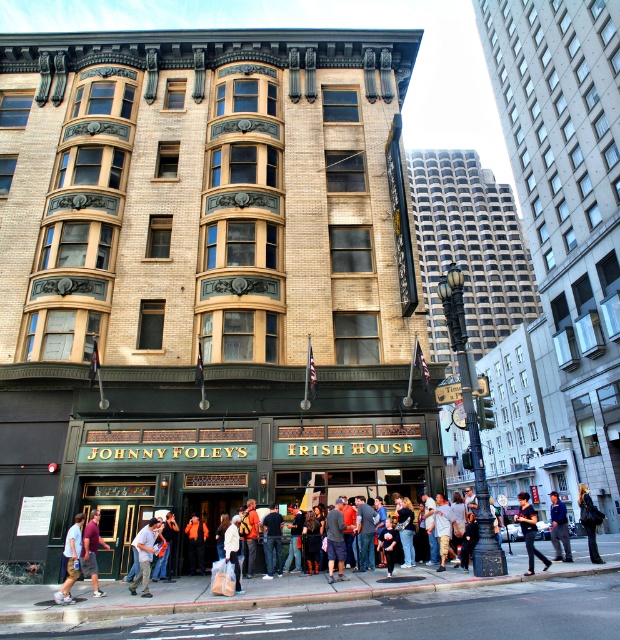
You are a delivery person standing at the entrance of Johnny Foley Irish House. You need to place a black leather jacket at the exact center of the building facade. Is the current position of the black leather jacket at center correct?

The black leather jacket at center is positioned at point (590, 520), which is not the exact center of the building facade. The exact center would be at point (310, 320), so the jacket needs to be moved closer to that coordinate.

You are a photographer standing outside Johnny Foley s Irish House and want to take a picture of the maroon shirt at center and the black leather jacket at center. Which object should you focus on first if you want to capture both in the frame without moving the camera?

The maroon shirt at center has a lesser height compared to the black leather jacket at center, so you should focus on the black leather jacket at center first to ensure both are in the frame.